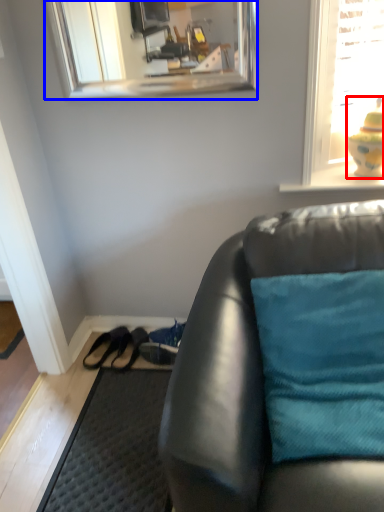
Question: Which point is closer to the camera, toy (highlighted by a red box) or mirror (highlighted by a blue box)?

Choices:
 (A) toy
 (B) mirror

Answer: (B)